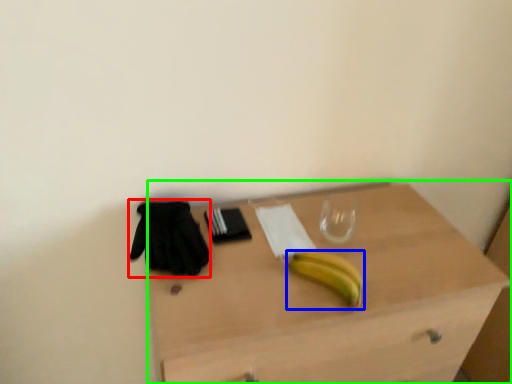
Question: Considering the real-world distances, which object is closest to glove (highlighted by a red box)? banana (highlighted by a blue box) or desk (highlighted by a green box).

Choices:
 (A) banana
 (B) desk

Answer: (A)